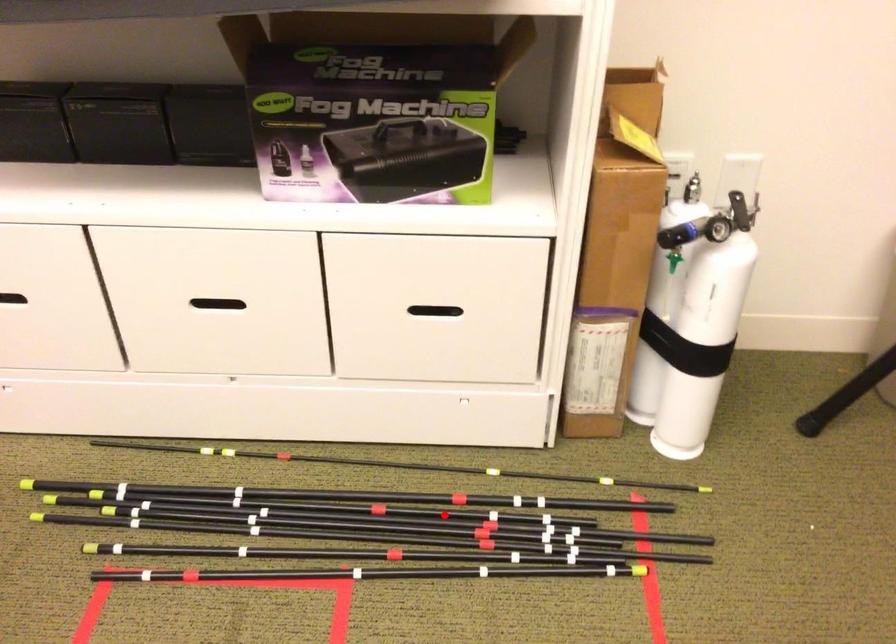
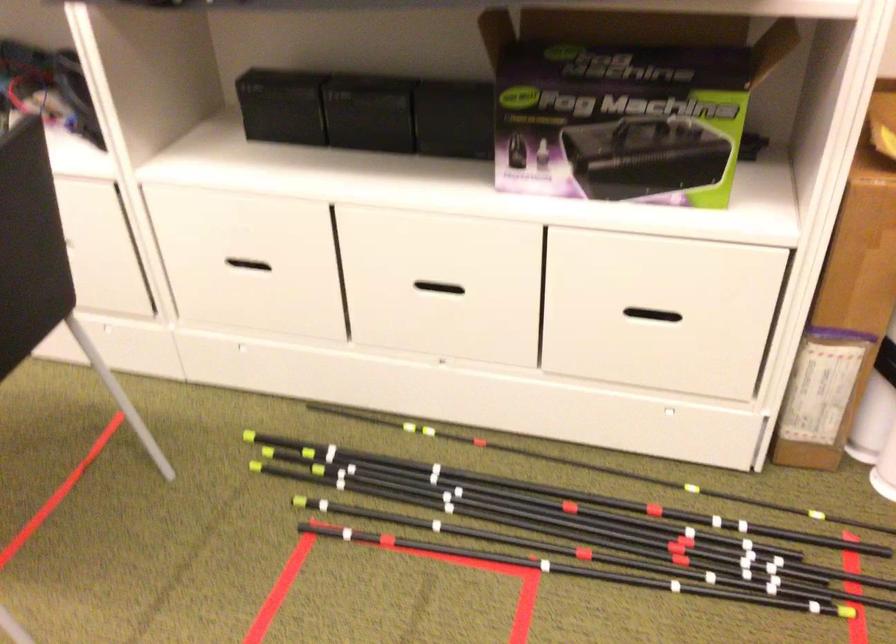
The point at the highlighted location is marked in the first image. Where is the corresponding point in the second image?

(638, 524)